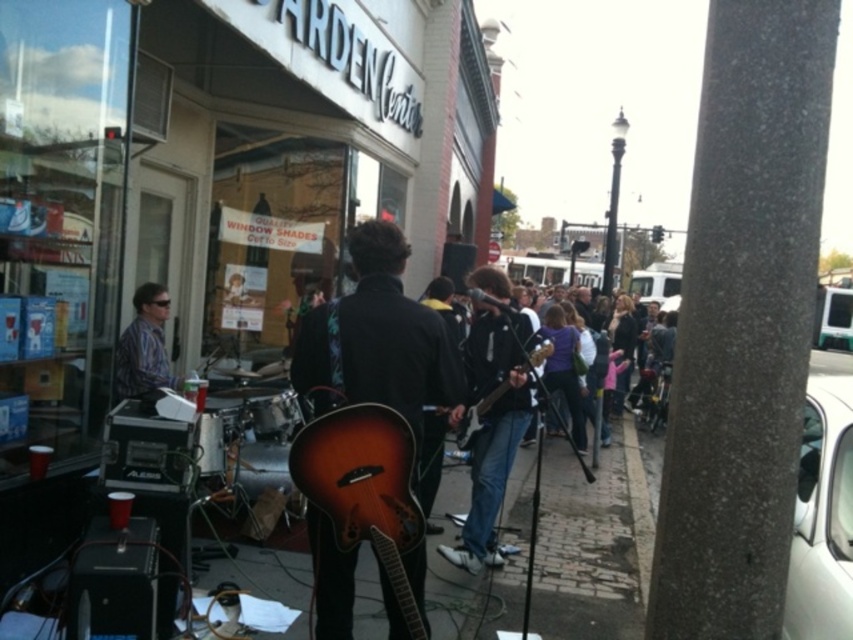
You are a photographer trying to capture both the striped shirt at left and the wooden electric guitar at center in the same frame. Based on their sizes in the image, which object should you focus on first to ensure both are in focus?

The striped shirt at left is taller than the wooden electric guitar at center, so focusing on the striped shirt at left first will help ensure both are in focus since it is larger and closer to the camera.